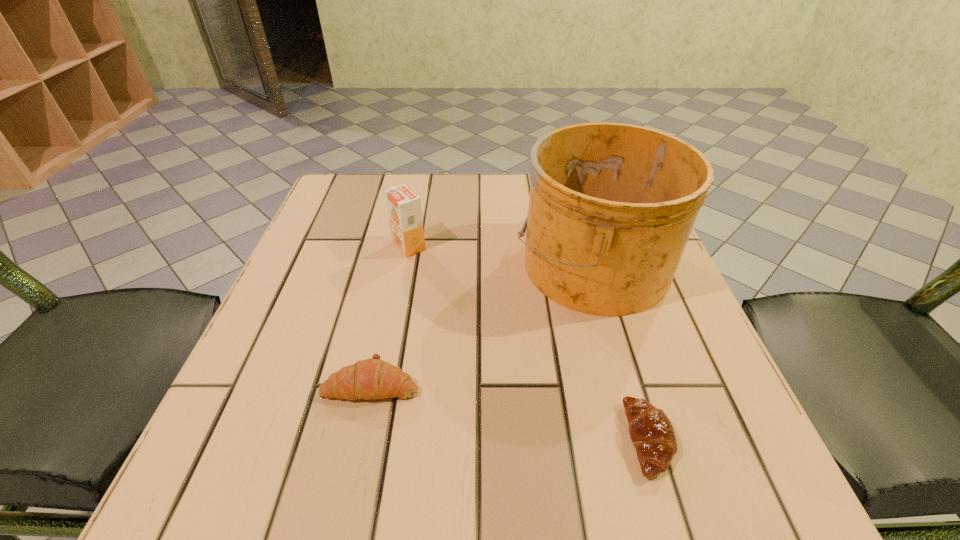
At what (x,y) coordinates should I click in order to perform the action: click on object located at the left edge. Please return your answer as a coordinate pair (x, y). This screenshot has height=540, width=960. Looking at the image, I should click on (373, 378).

The image size is (960, 540). In order to click on bucket present at the right edge in this screenshot , I will do `click(611, 207)`.

Where is `crescent roll located at the right edge`? crescent roll located at the right edge is located at coordinates (651, 432).

Where is `object that is at the far right corner`? This screenshot has height=540, width=960. object that is at the far right corner is located at coordinates (611, 207).

Where is `object situated at the near right corner`? The width and height of the screenshot is (960, 540). object situated at the near right corner is located at coordinates (651, 432).

In the image, there is a desktop. Where is `vacant space at the far edge`? vacant space at the far edge is located at coordinates (480, 178).

The image size is (960, 540). In order to click on vacant space at the near edge of the desktop in this screenshot , I will do `click(359, 451)`.

In the image, there is a desktop. Where is `vacant region at the left edge`? The height and width of the screenshot is (540, 960). vacant region at the left edge is located at coordinates (256, 336).

In the image, there is a desktop. Where is `free space at the right edge`? This screenshot has height=540, width=960. free space at the right edge is located at coordinates (623, 327).

Locate an element on the screen. The width and height of the screenshot is (960, 540). vacant space at the far left corner of the desktop is located at coordinates (362, 179).